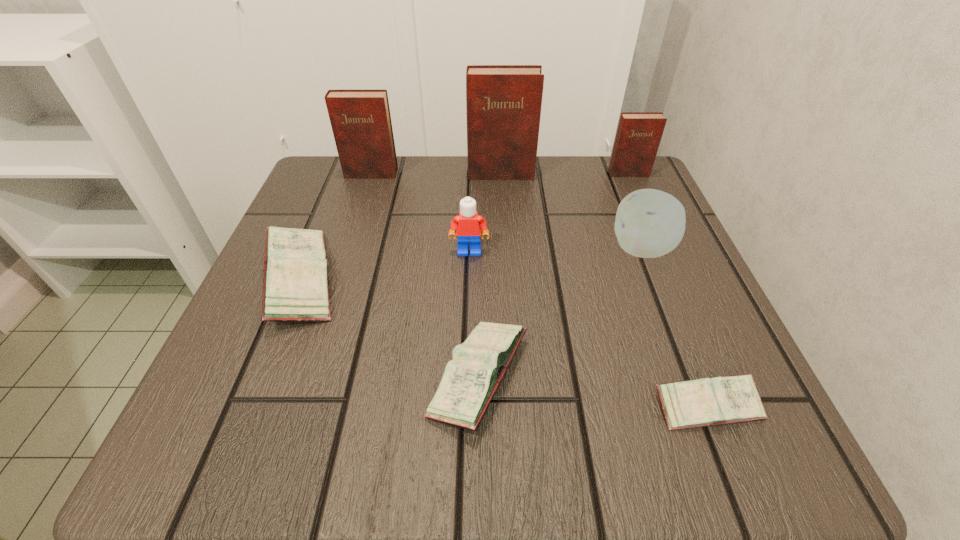
At what (x,y) coordinates should I click in order to perform the action: click on blank space located on the back of the second pink diary from right to left. Please return your answer as a coordinate pair (x, y). The width and height of the screenshot is (960, 540). Looking at the image, I should click on (479, 300).

You are a GUI agent. You are given a task and a screenshot of the screen. Output one action in this format:
    pyautogui.click(x=<x>, y=<y>)
    Task: Click on the free location located on the left of the rightmost pink diary
    This screenshot has height=540, width=960.
    Given the screenshot: What is the action you would take?
    pyautogui.click(x=595, y=406)

This screenshot has height=540, width=960. What are the coordinates of `apple situated at the right edge` in the screenshot? It's located at (650, 223).

Where is `object that is at the far left corner`? object that is at the far left corner is located at coordinates (361, 123).

You are a GUI agent. You are given a task and a screenshot of the screen. Output one action in this format:
    pyautogui.click(x=<x>, y=<y>)
    Task: Click on the object at the far right corner
    This screenshot has width=960, height=540.
    Given the screenshot: What is the action you would take?
    pyautogui.click(x=638, y=136)

This screenshot has width=960, height=540. I want to click on object positioned at the near right corner, so click(702, 402).

Identify the location of free space at the far edge. The height and width of the screenshot is (540, 960). (564, 173).

Locate an element on the screen. vacant region at the left edge of the desktop is located at coordinates (264, 269).

Image resolution: width=960 pixels, height=540 pixels. Find the location of `free location at the right edge`. free location at the right edge is located at coordinates (654, 286).

In the image, there is a desktop. Identify the location of vacant space at the far left corner. This screenshot has width=960, height=540. (337, 166).